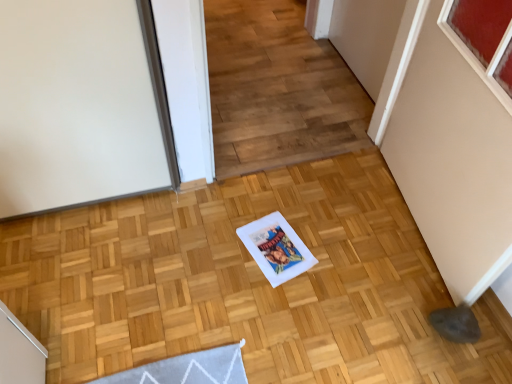
Find the location of `vacant region below white glossy postcard at center (from a real-world perspective)`. vacant region below white glossy postcard at center (from a real-world perspective) is located at coordinates (275, 251).